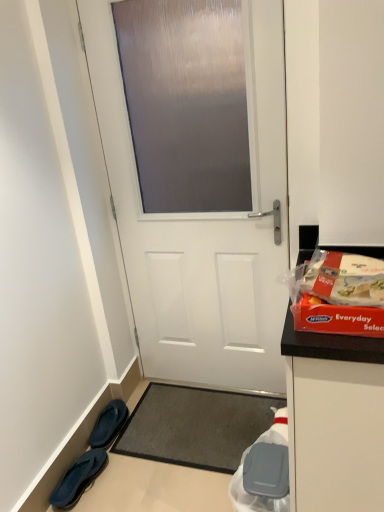
This screenshot has height=512, width=384. Describe the element at coordinates (195, 426) in the screenshot. I see `dark gray textured mat at center` at that location.

Measure the distance between dark gray textured mat at center and camera.

dark gray textured mat at center is 1.80 meters away from camera.

From the picture: What is the approximate height of white matte door at center?

6.31 feet.

The image size is (384, 512). Describe the element at coordinates (264, 471) in the screenshot. I see `white plastic bag at lower right, arranged as the second waste when viewed from the front` at that location.

Find the location of a particular element. dark gray textured mat at center is located at coordinates (195, 426).

Does dark gray textured mat at center appear on the left side of white plastic bag at lower right, arranged as the second waste when viewed from the front?

Correct, you'll find dark gray textured mat at center to the left of white plastic bag at lower right, arranged as the second waste when viewed from the front.

You are a GUI agent. You are given a task and a screenshot of the screen. Output one action in this format:
    pyautogui.click(x=<x>, y=<y>)
    Task: Click on the waste that is the 1st object to the right of the dark gray textured mat at center, starting at the anchor
    This screenshot has height=512, width=384.
    Given the screenshot: What is the action you would take?
    pyautogui.click(x=264, y=471)

Looking at this image, from the image's perspective, is dark gray textured mat at center above or below white plastic bag at lower right, arranged as the second waste when viewed from the front?

dark gray textured mat at center is situated higher than white plastic bag at lower right, arranged as the second waste when viewed from the front, in the image.

From a real-world perspective, between dark gray textured mat at center and white plastic bag at lower right, which is the 1th waste from bottom to top, who is vertically lower?

From a 3D spatial view, dark gray textured mat at center is below.

Considering the relative sizes of white plastic bag at lower right, arranged as the second waste when viewed from the front, and red plastic box at right, arranged as the second waste when viewed from the back, in the image provided, is white plastic bag at lower right, arranged as the second waste when viewed from the front, thinner than red plastic box at right, arranged as the second waste when viewed from the back,?

Yes.

Based on the photo, can you tell me how much white plastic bag at lower right, positioned as the 2th waste in top-to-bottom order, and red plastic box at right, acting as the second waste starting from the bottom, differ in facing direction?

The angle between the facing direction of white plastic bag at lower right, positioned as the 2th waste in top-to-bottom order, and the facing direction of red plastic box at right, acting as the second waste starting from the bottom, is 82.4 degrees.

Who is taller, white plastic bag at lower right, which is the 1th waste from bottom to top, or red plastic box at right, arranged as the 1th waste when viewed from the top?

white plastic bag at lower right, which is the 1th waste from bottom to top.

Between white plastic bag at lower right, positioned as the 2th waste in top-to-bottom order, and red plastic box at right, arranged as the second waste when viewed from the back, which one is positioned behind?

white plastic bag at lower right, positioned as the 2th waste in top-to-bottom order, is further away from the camera.

Could you tell me if black fabric slippers at lower left, positioned as the second footwear in front-to-back order, is facing dark gray textured mat at center?

Yes, black fabric slippers at lower left, positioned as the second footwear in front-to-back order, is facing dark gray textured mat at center.

Is black fabric slippers at lower left, acting as the 1th footwear starting from the back, completely or partially outside of dark gray textured mat at center?

Yes, black fabric slippers at lower left, acting as the 1th footwear starting from the back, is outside of dark gray textured mat at center.

This screenshot has height=512, width=384. Find the location of `yoga mat located underneath the black fabric slippers at lower left, positioned as the second footwear in front-to-back order (from a real-world perspective)`. yoga mat located underneath the black fabric slippers at lower left, positioned as the second footwear in front-to-back order (from a real-world perspective) is located at coordinates (195, 426).

Is the position of dark gray textured mat at center more distant than that of blue fabric slippers at lower left, the first footwear in the front-to-back sequence?

Yes.

How many degrees apart are the facing directions of dark gray textured mat at center and blue fabric slippers at lower left, the 2th footwear viewed from the back?

There is a 89.9-degree angle between the facing directions of dark gray textured mat at center and blue fabric slippers at lower left, the 2th footwear viewed from the back.

From the image's perspective, who appears lower, dark gray textured mat at center or blue fabric slippers at lower left, the 2th footwear viewed from the back?

blue fabric slippers at lower left, the 2th footwear viewed from the back, from the image's perspective.

How far apart are dark gray textured mat at center and blue fabric slippers at lower left, the 2th footwear viewed from the back?

The distance of dark gray textured mat at center from blue fabric slippers at lower left, the 2th footwear viewed from the back, is 41.06 centimeters.

Which footwear is the 2nd one when counting from the back of the white matte door at center? Please provide its 2D coordinates.

[(108, 424)]

Are white matte door at center and black fabric slippers at lower left, positioned as the second footwear in front-to-back order, located far from each other?

No, white matte door at center is in close proximity to black fabric slippers at lower left, positioned as the second footwear in front-to-back order.

Is white matte door at center completely or partially outside of black fabric slippers at lower left, acting as the 1th footwear starting from the back?

Indeed, white matte door at center is completely outside black fabric slippers at lower left, acting as the 1th footwear starting from the back.

Is white matte door at center turned away from black fabric slippers at lower left, positioned as the second footwear in front-to-back order?

No, white matte door at center is not facing the opposite direction of black fabric slippers at lower left, positioned as the second footwear in front-to-back order.

Looking at this image, between white plastic bag at lower right, which is the 1th waste from bottom to top, and dark gray textured mat at center, which one appears on the left side from the viewer's perspective?

dark gray textured mat at center is more to the left.

Considering the sizes of objects white plastic bag at lower right, which is the 1th waste from bottom to top, and dark gray textured mat at center in the image provided, who is wider, white plastic bag at lower right, which is the 1th waste from bottom to top, or dark gray textured mat at center?

Wider between the two is dark gray textured mat at center.

Considering the sizes of white plastic bag at lower right, positioned as the 2th waste in top-to-bottom order, and dark gray textured mat at center in the image, is white plastic bag at lower right, positioned as the 2th waste in top-to-bottom order, bigger or smaller than dark gray textured mat at center?

Considering their sizes, white plastic bag at lower right, positioned as the 2th waste in top-to-bottom order, takes up more space than dark gray textured mat at center.

Which is correct: white plastic bag at lower right, which is the 1th waste from bottom to top, is inside dark gray textured mat at center, or outside of it?

white plastic bag at lower right, which is the 1th waste from bottom to top, is not enclosed by dark gray textured mat at center.

Considering the points (325, 258) and (205, 434), which point is in front, point (325, 258) or point (205, 434)?

The point (325, 258) is in front.

Image resolution: width=384 pixels, height=512 pixels. Identify the location of yoga mat that is below the red plastic box at right, arranged as the 1th waste when viewed from the top (from the image's perspective). (195, 426).

Is red plastic box at right, arranged as the second waste when viewed from the back, placed right next to dark gray textured mat at center?

No, red plastic box at right, arranged as the second waste when viewed from the back, is not touching dark gray textured mat at center.

Based on the photo, does red plastic box at right, acting as the second waste starting from the bottom, have a lesser height compared to dark gray textured mat at center?

In fact, red plastic box at right, acting as the second waste starting from the bottom, may be taller than dark gray textured mat at center.

At what (x,y) coordinates should I click in order to perform the action: click on yoga mat beneath the white plastic bag at lower right, which is the 1th waste from bottom to top (from a real-world perspective). Please return your answer as a coordinate pair (x, y). Looking at the image, I should click on pos(195,426).

At what (x,y) coordinates should I click in order to perform the action: click on waste that is in front of the white plastic bag at lower right, the 1th waste from the back. Please return your answer as a coordinate pair (x, y). This screenshot has width=384, height=512. Looking at the image, I should click on (339, 295).

Estimate the real-world distances between objects in this image. Which object is further from white plastic bag at lower right, the 1th waste from the back, dark gray textured mat at center or red plastic box at right, acting as the second waste starting from the bottom?

Among the two, red plastic box at right, acting as the second waste starting from the bottom, is located further to white plastic bag at lower right, the 1th waste from the back.

Based on the photo, estimate the real-world distances between objects in this image. Which object is closer to dark gray textured mat at center, black fabric slippers at lower left, acting as the 1th footwear starting from the back, or white matte door at center?

black fabric slippers at lower left, acting as the 1th footwear starting from the back.

Looking at the image, which one is located closer to black fabric slippers at lower left, acting as the 1th footwear starting from the back, white matte door at center or blue fabric slippers at lower left, the 2th footwear viewed from the back?

blue fabric slippers at lower left, the 2th footwear viewed from the back, is closer to black fabric slippers at lower left, acting as the 1th footwear starting from the back.

Looking at the image, which one is located further to black fabric slippers at lower left, acting as the 1th footwear starting from the back, blue fabric slippers at lower left, the first footwear in the front-to-back sequence, or white matte door at center?

white matte door at center lies further to black fabric slippers at lower left, acting as the 1th footwear starting from the back, than the other object.

Which object lies further to the anchor point blue fabric slippers at lower left, the first footwear in the front-to-back sequence, red plastic box at right, acting as the second waste starting from the bottom, or white plastic bag at lower right, the 1th waste from the back?

red plastic box at right, acting as the second waste starting from the bottom, is positioned further to the anchor blue fabric slippers at lower left, the first footwear in the front-to-back sequence.

Based on their spatial positions, is dark gray textured mat at center or white plastic bag at lower right, the 1th waste from the back, further from red plastic box at right, acting as the 1th waste starting from the front?

dark gray textured mat at center.

Estimate the real-world distances between objects in this image. Which object is closer to dark gray textured mat at center, blue fabric slippers at lower left, the 2th footwear viewed from the back, or white plastic bag at lower right, arranged as the second waste when viewed from the front?

white plastic bag at lower right, arranged as the second waste when viewed from the front, is positioned closer to the anchor dark gray textured mat at center.

Considering their positions, is white plastic bag at lower right, positioned as the 2th waste in top-to-bottom order, positioned further to white matte door at center than black fabric slippers at lower left, acting as the 1th footwear starting from the back?

Based on the image, black fabric slippers at lower left, acting as the 1th footwear starting from the back, appears to be further to white matte door at center.

Identify the location of footwear situated between blue fabric slippers at lower left, the first footwear in the front-to-back sequence, and red plastic box at right, acting as the 1th waste starting from the front, from left to right. The height and width of the screenshot is (512, 384). (108, 424).

I want to click on yoga mat located between red plastic box at right, acting as the 1th waste starting from the front, and black fabric slippers at lower left, acting as the 1th footwear starting from the back, in the depth direction, so click(195, 426).

At what (x,y) coordinates should I click in order to perform the action: click on waste between white matte door at center and white plastic bag at lower right, the 1th waste from the back, in the up-down direction. Please return your answer as a coordinate pair (x, y). The image size is (384, 512). Looking at the image, I should click on (339, 295).

Locate an element on the screen. The image size is (384, 512). footwear between white matte door at center and white plastic bag at lower right, positioned as the 2th waste in top-to-bottom order, in the vertical direction is located at coordinates click(108, 424).